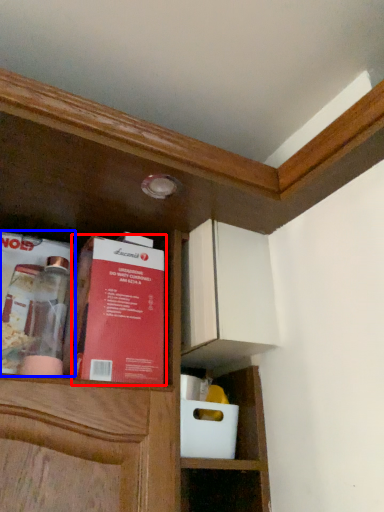
Question: Among these objects, which one is farthest to the camera, book (highlighted by a red box) or book (highlighted by a blue box)?

Choices:
 (A) book
 (B) book

Answer: (B)